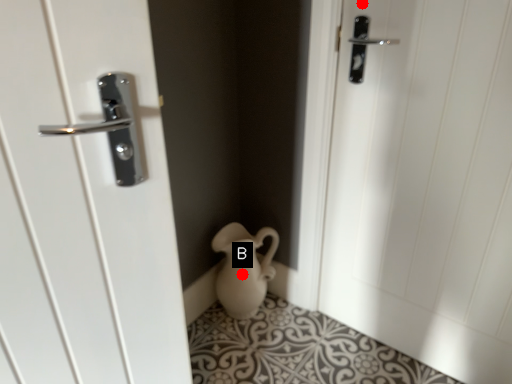
Question: Two points are circled on the image, labeled by A and B beside each circle. Which point appears farthest from the camera in this image?

Choices:
 (A) A is further
 (B) B is further

Answer: (B)